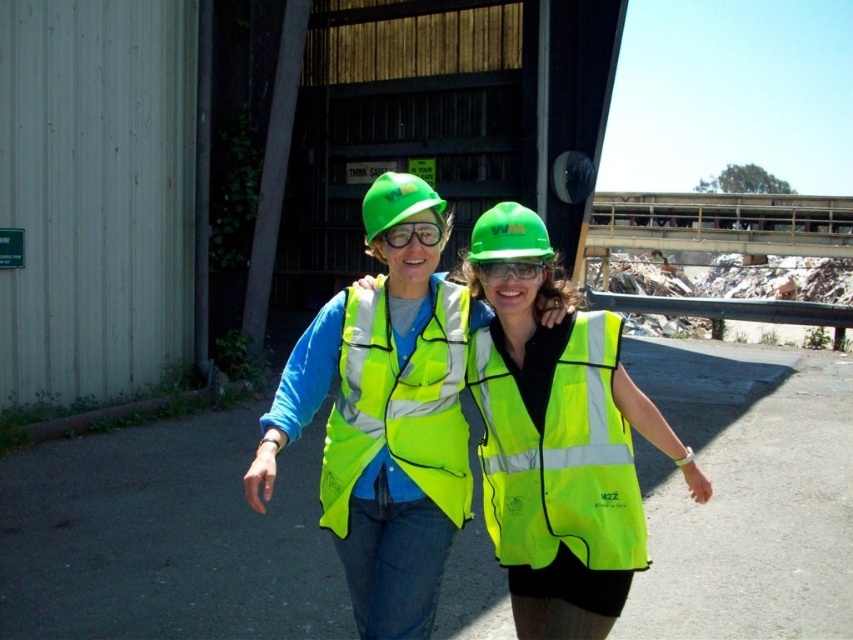
You are a safety inspector checking the visibility of safety gear in the image. You need to determine if the neon yellow reflective vest at center is positioned correctly according to safety standards. According to the standards, the vest must be visible from all angles within a 360 degree radius. Is the vest at point [384,432] visible from all angles? Please answer based on the description provided.

The neon yellow reflective vest at center is located at point [384,432]. Since the description states that the vest is at the center, it is positioned in a central location which typically allows visibility from all angles within the 360 degree radius as required by safety standards.

You are a safety inspector checking the equipment of workers at an industrial site. You notice two items at the center of your view. Which item is closer to you, the green hard hat at center or the clear plastic goggles at center?

The green hard hat at center is closer to you than the clear plastic goggles at center.